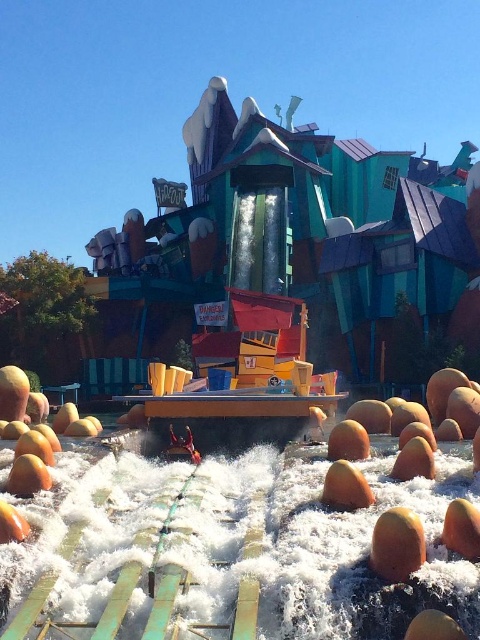
Question: Can you confirm if orange matte fruit at lower right is positioned to the right of smooth orange fruit at center?

Choices:
 (A) no
 (B) yes

Answer: (B)

Question: Does orange matte fruit at lower right appear under smooth orange fruit at center?

Choices:
 (A) no
 (B) yes

Answer: (B)

Question: Which of the following is the closest to the observer?

Choices:
 (A) orange matte fruit at lower center
 (B) brown rubber water at lower center
 (C) orange matte fruit at lower right

Answer: (A)

Question: Which point is closer to the camera?

Choices:
 (A) (434, 611)
 (B) (408, 518)

Answer: (A)

Question: Among these points, which one is farthest from the camera?

Choices:
 (A) (427, 576)
 (B) (389, 566)
 (C) (266, 502)
 (D) (456, 636)

Answer: (C)

Question: Observing the image, what is the correct spatial positioning of green rubber raft at center in reference to brown rubber water at lower center?

Choices:
 (A) left
 (B) right

Answer: (A)